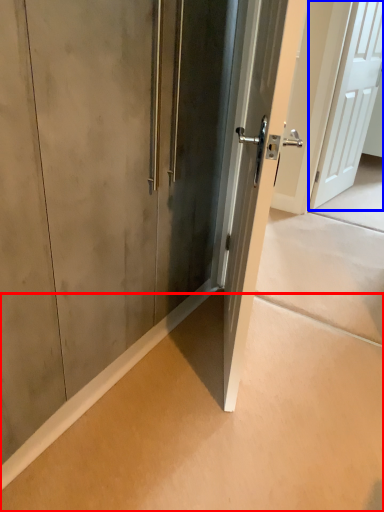
Question: Which of the following is the closest to the observer, concrete (highlighted by a red box) or door (highlighted by a blue box)?

Choices:
 (A) concrete
 (B) door

Answer: (A)